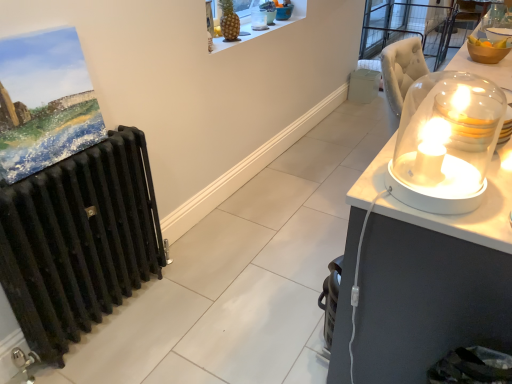
Question: Can you confirm if white plastic trash bin/can at right is smaller than white glossy candle holder at right, the 3th candle holder when ordered from right to left?

Choices:
 (A) yes
 (B) no

Answer: (A)

Question: Does white plastic trash bin/can at right turn towards white glossy candle holder at right, the 1th candle holder positioned from the front?

Choices:
 (A) no
 (B) yes

Answer: (A)

Question: Considering the relative positions of white plastic trash bin/can at right and white glossy candle holder at right, the fourth candle holder when ordered from top to bottom, in the image provided, is white plastic trash bin/can at right to the right of white glossy candle holder at right, the fourth candle holder when ordered from top to bottom, from the viewer's perspective?

Choices:
 (A) no
 (B) yes

Answer: (B)

Question: Considering the relative sizes of white plastic trash bin/can at right and white glossy candle holder at right, which is counted as the first candle holder, starting from the bottom, in the image provided, is white plastic trash bin/can at right bigger than white glossy candle holder at right, which is counted as the first candle holder, starting from the bottom,?

Choices:
 (A) no
 (B) yes

Answer: (A)

Question: From a real-world perspective, is white plastic trash bin/can at right below white glossy candle holder at right, the 3th candle holder when ordered from right to left?

Choices:
 (A) no
 (B) yes

Answer: (B)

Question: Is white glossy candle holder at right, which appears as the fourth candle holder when viewed from the back, a part of white plastic trash bin/can at right?

Choices:
 (A) no
 (B) yes

Answer: (A)

Question: From a real-world perspective, is translucent glass dome at upper center, the 1th candle holder viewed from the top, below matte acrylic painting at left?

Choices:
 (A) no
 (B) yes

Answer: (A)

Question: Does translucent glass dome at upper center, which appears as the fourth candle holder when viewed from the right, have a greater height compared to matte acrylic painting at left?

Choices:
 (A) no
 (B) yes

Answer: (A)

Question: From the image's perspective, would you say translucent glass dome at upper center, which appears as the fourth candle holder when ordered from the bottom, is positioned over matte acrylic painting at left?

Choices:
 (A) no
 (B) yes

Answer: (B)

Question: Is the position of translucent glass dome at upper center, the 1th candle holder viewed from the top, less distant than that of matte acrylic painting at left?

Choices:
 (A) yes
 (B) no

Answer: (B)

Question: Is matte acrylic painting at left a part of translucent glass dome at upper center, which is the 4th candle holder from front to back?

Choices:
 (A) no
 (B) yes

Answer: (A)

Question: Is translucent glass dome at upper center, the 1th candle holder viewed from the top, far away from matte acrylic painting at left?

Choices:
 (A) yes
 (B) no

Answer: (A)

Question: Considering the relative sizes of translucent glass candle at right, placed as the third candle holder when sorted from back to front, and golden pineapple at upper center in the image provided, is translucent glass candle at right, placed as the third candle holder when sorted from back to front, taller than golden pineapple at upper center?

Choices:
 (A) no
 (B) yes

Answer: (A)